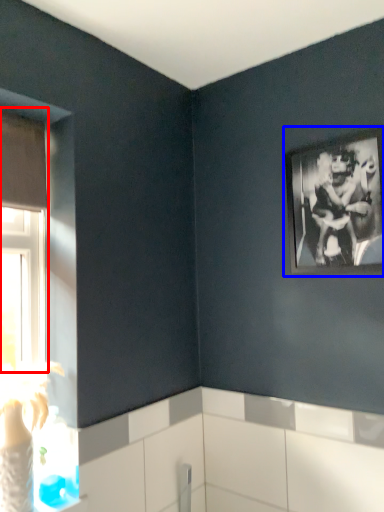
Question: Which of the following is the closest to the observer, window (highlighted by a red box) or picture frame (highlighted by a blue box)?

Choices:
 (A) window
 (B) picture frame

Answer: (A)